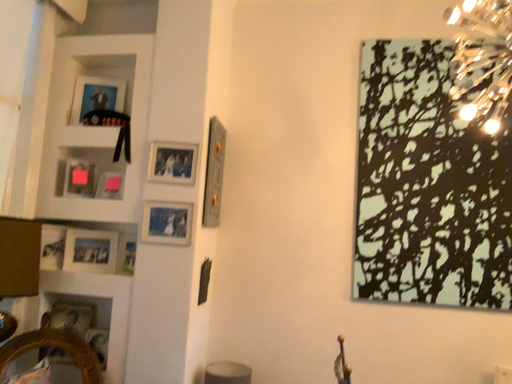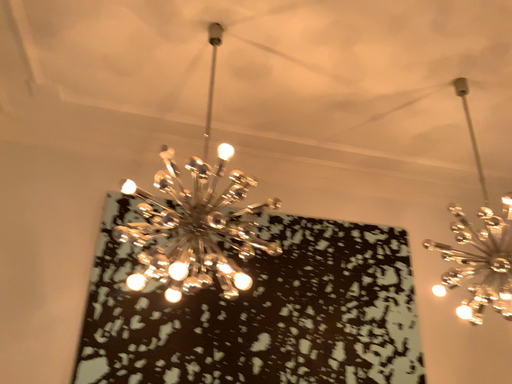
Question: How did the camera likely rotate when shooting the video?

Choices:
 (A) rotated downward
 (B) rotated upward

Answer: (B)